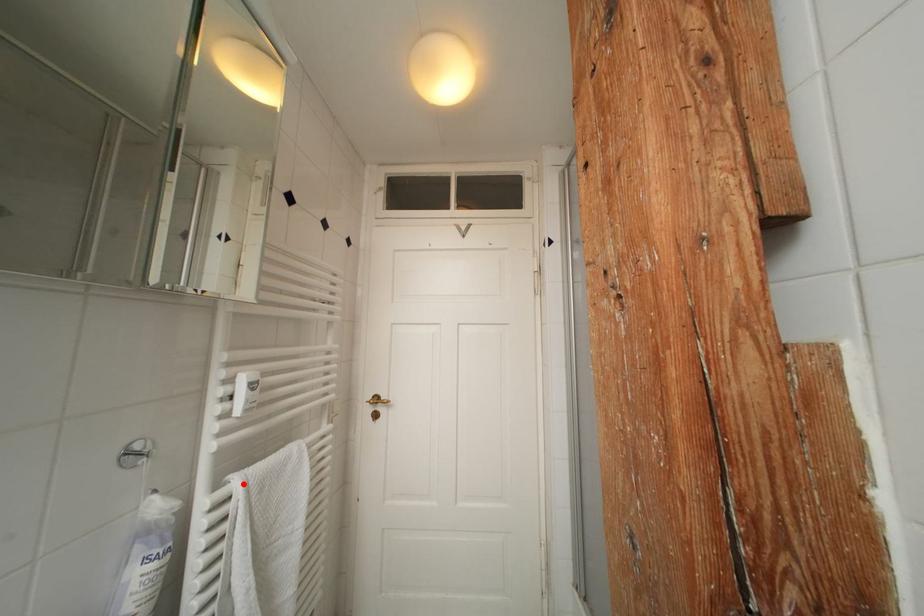
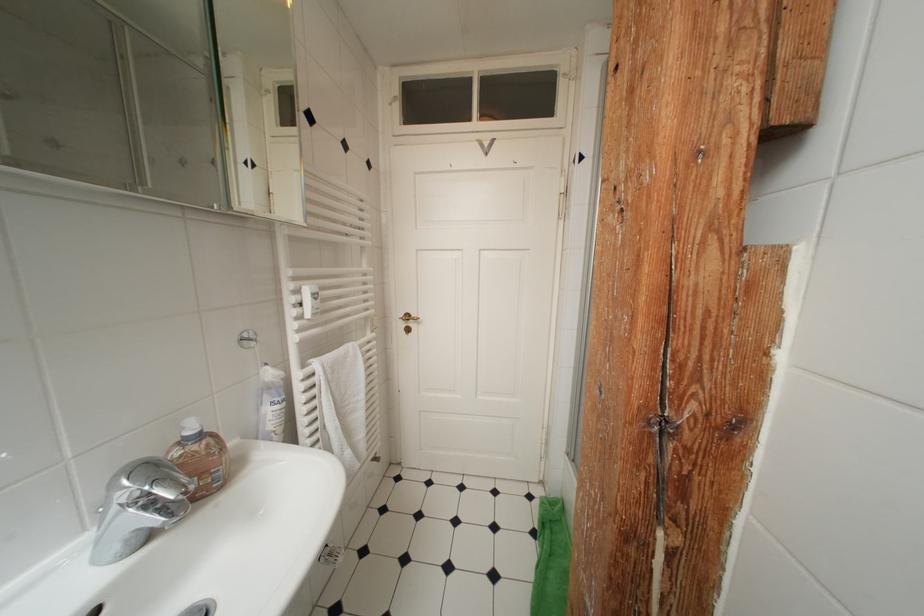
In the second image, find the point that corresponds to the highlighted location in the first image.

(322, 368)